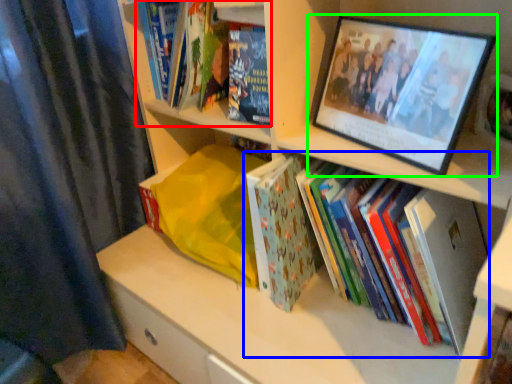
Question: Which object is positioned closest to book (highlighted by a red box)? Select from book (highlighted by a blue box) and picture frame (highlighted by a green box).

Choices:
 (A) book
 (B) picture frame

Answer: (B)